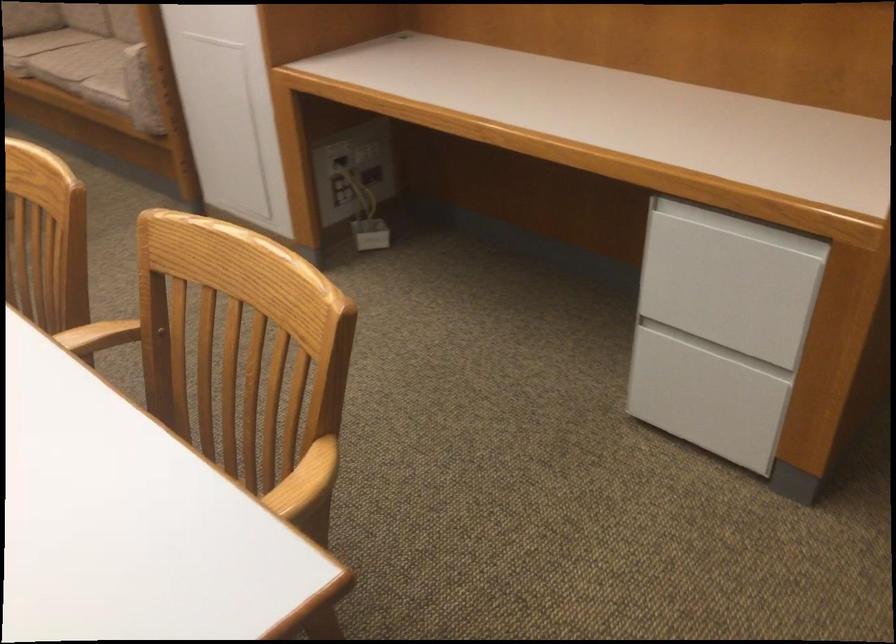
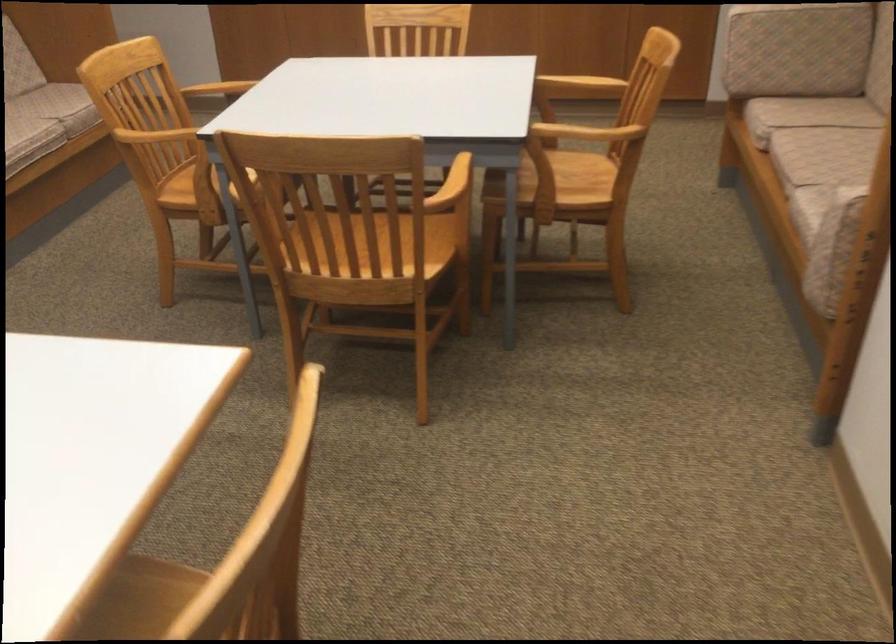
Locate, in the second image, the point that corresponds to pixel 108 73 in the first image.

(822, 190)